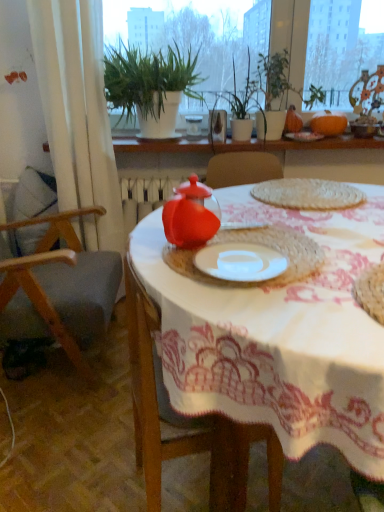
Identify the location of vacant space to the right of white matte plate at center. (324, 266).